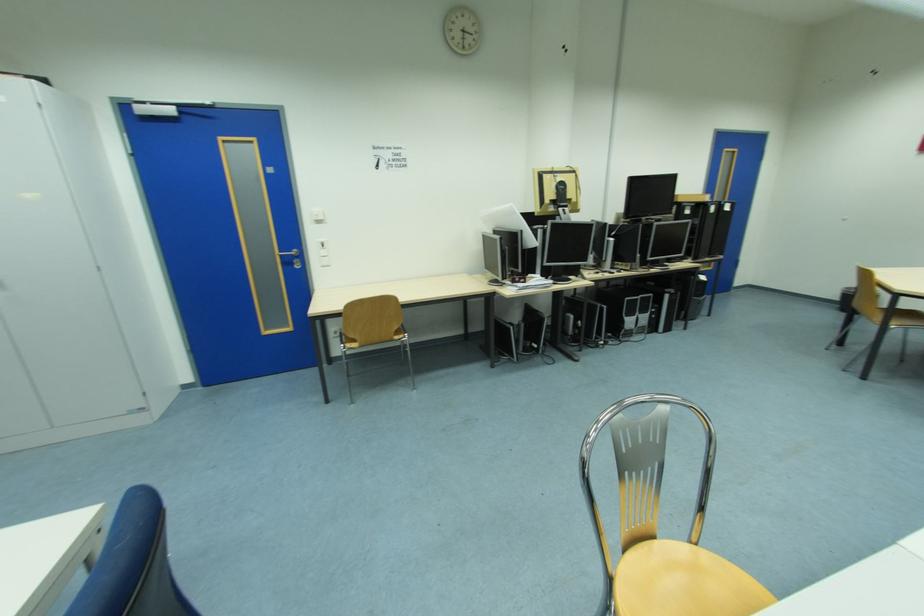
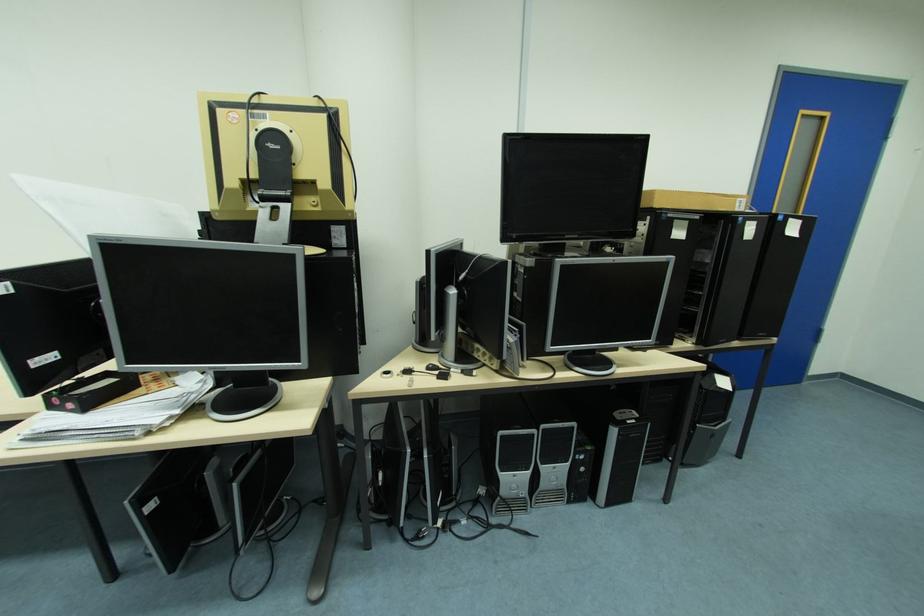
Find the pixel in the second image that matches the point at 634,300 in the first image.

(507, 434)